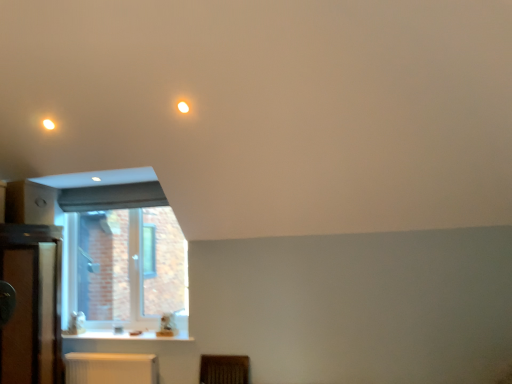
You are a GUI agent. You are given a task and a screenshot of the screen. Output one action in this format:
    pyautogui.click(x=<x>, y=<y>)
    Task: Click on the matte white light fixture at upper left, which is counted as the 2th lighting, starting from the right
    This screenshot has height=384, width=512.
    Given the screenshot: What is the action you would take?
    pyautogui.click(x=48, y=124)

The image size is (512, 384). Describe the element at coordinates (110, 368) in the screenshot. I see `white plastic radiator at lower center` at that location.

This screenshot has height=384, width=512. What do you see at coordinates (183, 107) in the screenshot? I see `matte white light at upper center, marked as the second lighting in a left-to-right arrangement` at bounding box center [183, 107].

The width and height of the screenshot is (512, 384). Identify the location of matte white light fixture at upper left, the 1th lighting when ordered from left to right. (48, 124).

Does clear glass window at lower left lie in front of white glossy counter top at lower left?

No, clear glass window at lower left is behind white glossy counter top at lower left.

From a real-world perspective, is clear glass window at lower left on top of white glossy counter top at lower left?

Yes, from a real-world perspective, clear glass window at lower left is above white glossy counter top at lower left.

Is clear glass window at lower left oriented towards white glossy counter top at lower left?

Yes, clear glass window at lower left is turned towards white glossy counter top at lower left.

How far apart are clear glass window at lower left and white glossy counter top at lower left?

clear glass window at lower left is 65.97 centimeters away from white glossy counter top at lower left.

In the scene shown: From a real-world perspective, which object rests below the other?

white plastic radiator at lower center is physically lower.

Is white plastic radiator at lower center far from clear glass window at lower left?

No.

Which of these two, white plastic radiator at lower center or clear glass window at lower left, stands shorter?

With less height is white plastic radiator at lower center.

Is the surface of wooden dresser at left in direct contact with matte white light at upper center, marked as the 2th lighting in a back-to-front arrangement?

wooden dresser at left and matte white light at upper center, marked as the 2th lighting in a back-to-front arrangement, are not in contact.

Is wooden dresser at left inside the boundaries of matte white light at upper center, marked as the 2th lighting in a back-to-front arrangement, or outside?

wooden dresser at left exists outside the volume of matte white light at upper center, marked as the 2th lighting in a back-to-front arrangement.

From the image's perspective, would you say wooden dresser at left is shown under matte white light at upper center, the first lighting viewed from the right?

Indeed, from the image's perspective, wooden dresser at left is shown beneath matte white light at upper center, the first lighting viewed from the right.

Is matte white light at upper center, marked as the 2th lighting in a back-to-front arrangement, closer to camera compared to white glossy counter top at lower left?

Yes, the depth of matte white light at upper center, marked as the 2th lighting in a back-to-front arrangement, is less than that of white glossy counter top at lower left.

Considering the positions of points (178, 105) and (119, 335), is point (178, 105) closer to camera compared to point (119, 335)?

Yes, it is in front of point (119, 335).

Considering the relative sizes of matte white light at upper center, marked as the second lighting in a left-to-right arrangement, and white glossy counter top at lower left in the image provided, is matte white light at upper center, marked as the second lighting in a left-to-right arrangement, bigger than white glossy counter top at lower left?

No.

Is matte white light at upper center, marked as the 2th lighting in a back-to-front arrangement, not inside white glossy counter top at lower left?

Yes.

Can matte white light at upper center, marked as the first lighting in a front-to-back arrangement, be found inside white plastic radiator at lower center?

No, matte white light at upper center, marked as the first lighting in a front-to-back arrangement, is not a part of white plastic radiator at lower center.

Considering the relative positions of white plastic radiator at lower center and matte white light at upper center, marked as the second lighting in a left-to-right arrangement, in the image provided, is white plastic radiator at lower center to the right of matte white light at upper center, marked as the second lighting in a left-to-right arrangement, from the viewer's perspective?

No.

Which point is more forward, (121, 367) or (188, 111)?

Positioned in front is point (188, 111).

Is clear glass window at lower left surrounding matte white light at upper center, marked as the 2th lighting in a back-to-front arrangement?

No, clear glass window at lower left does not contain matte white light at upper center, marked as the 2th lighting in a back-to-front arrangement.

From the image's perspective, which is above, clear glass window at lower left or matte white light at upper center, marked as the second lighting in a left-to-right arrangement?

matte white light at upper center, marked as the second lighting in a left-to-right arrangement, appears higher in the image.

Is clear glass window at lower left not near matte white light at upper center, marked as the first lighting in a front-to-back arrangement?

Yes, clear glass window at lower left is far from matte white light at upper center, marked as the first lighting in a front-to-back arrangement.

Considering the relative positions of clear glass window at lower left and matte white light at upper center, the first lighting viewed from the right, in the image provided, is clear glass window at lower left to the right of matte white light at upper center, the first lighting viewed from the right, from the viewer's perspective?

Incorrect, clear glass window at lower left is not on the right side of matte white light at upper center, the first lighting viewed from the right.

Which is more distant, (x=183, y=339) or (x=138, y=382)?

Point (x=183, y=339)

How much distance is there between white glossy counter top at lower left and white plastic radiator at lower center?

white glossy counter top at lower left is 10.77 inches from white plastic radiator at lower center.

Are white glossy counter top at lower left and white plastic radiator at lower center making contact?

There is a gap between white glossy counter top at lower left and white plastic radiator at lower center.

Find the location of a particular element. The image size is (512, 384). counter top located underneath the clear glass window at lower left (from a real-world perspective) is located at coordinates (129, 335).

Identify the location of window behind the white plastic radiator at lower center. The image size is (512, 384). (131, 251).

Which object lies further to the anchor point white glossy counter top at lower left, white plastic radiator at lower center or matte white light at upper center, the first lighting viewed from the right?

The object further to white glossy counter top at lower left is matte white light at upper center, the first lighting viewed from the right.

Which object lies further to the anchor point wooden dresser at left, white glossy counter top at lower left or matte white light at upper center, marked as the 2th lighting in a back-to-front arrangement?

Among the two, matte white light at upper center, marked as the 2th lighting in a back-to-front arrangement, is located further to wooden dresser at left.

Estimate the real-world distances between objects in this image. Which object is further from white glossy counter top at lower left, matte white light at upper center, marked as the second lighting in a left-to-right arrangement, or clear glass window at lower left?

Among the two, matte white light at upper center, marked as the second lighting in a left-to-right arrangement, is located further to white glossy counter top at lower left.

Estimate the real-world distances between objects in this image. Which object is closer to matte white light at upper center, the first lighting viewed from the right, white plastic radiator at lower center or matte white light fixture at upper left, the 1th lighting when ordered from left to right?

matte white light fixture at upper left, the 1th lighting when ordered from left to right, lies closer to matte white light at upper center, the first lighting viewed from the right, than the other object.

Considering their positions, is white plastic radiator at lower center positioned further to clear glass window at lower left than matte white light fixture at upper left, placed as the second lighting when sorted from front to back?

Based on the image, matte white light fixture at upper left, placed as the second lighting when sorted from front to back, appears to be further to clear glass window at lower left.

Based on their spatial positions, is clear glass window at lower left or matte white light fixture at upper left, placed as the second lighting when sorted from front to back, closer to wooden dresser at left?

clear glass window at lower left.

Estimate the real-world distances between objects in this image. Which object is closer to white glossy counter top at lower left, matte white light fixture at upper left, placed as the second lighting when sorted from front to back, or wooden dresser at left?

wooden dresser at left is closer to white glossy counter top at lower left.

Estimate the real-world distances between objects in this image. Which object is closer to wooden dresser at left, matte white light fixture at upper left, the 1th lighting positioned from the back, or matte white light at upper center, marked as the first lighting in a front-to-back arrangement?

matte white light fixture at upper left, the 1th lighting positioned from the back, is positioned closer to the anchor wooden dresser at left.

Locate an element on the screen. The height and width of the screenshot is (384, 512). lighting that lies between matte white light at upper center, marked as the second lighting in a left-to-right arrangement, and white plastic radiator at lower center from top to bottom is located at coordinates (48, 124).

You are a GUI agent. You are given a task and a screenshot of the screen. Output one action in this format:
    pyautogui.click(x=<x>, y=<y>)
    Task: Click on the window between matte white light at upper center, marked as the 2th lighting in a back-to-front arrangement, and white plastic radiator at lower center in the up-down direction
    This screenshot has width=512, height=384.
    Given the screenshot: What is the action you would take?
    pyautogui.click(x=131, y=251)

You are a GUI agent. You are given a task and a screenshot of the screen. Output one action in this format:
    pyautogui.click(x=<x>, y=<y>)
    Task: Click on the counter top between matte white light at upper center, the first lighting viewed from the right, and white plastic radiator at lower center from top to bottom
    The width and height of the screenshot is (512, 384).
    Given the screenshot: What is the action you would take?
    pyautogui.click(x=129, y=335)

The height and width of the screenshot is (384, 512). I want to click on dresser between matte white light fixture at upper left, placed as the second lighting when sorted from front to back, and white plastic radiator at lower center, in the vertical direction, so click(32, 304).